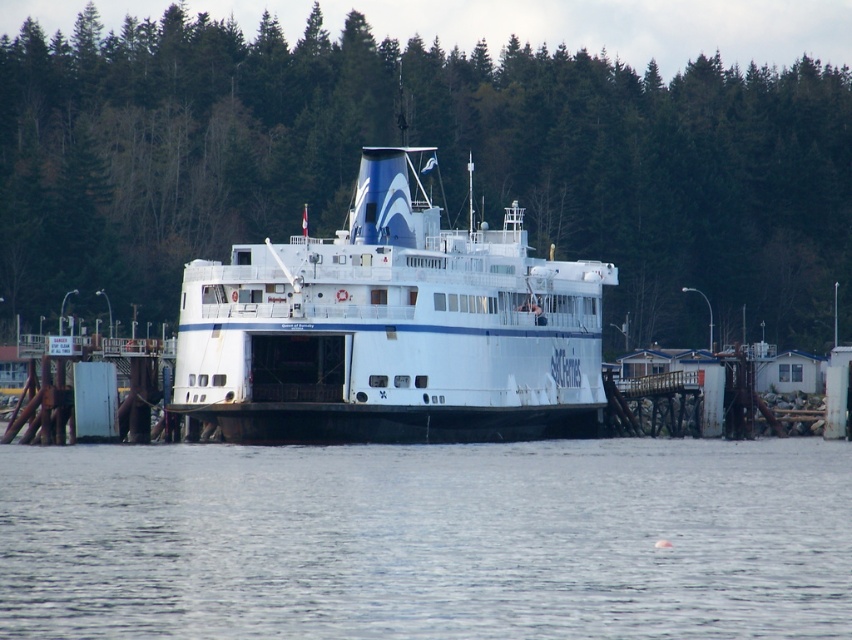
You are a passenger on the ferry and looking towards the shore. You notice the green leafy trees at upper center and the white matte ferry at center. Which object appears taller from your vantage point?

The green leafy trees at upper center appear taller than the white matte ferry at center from your vantage point because the green leafy trees at upper center has a greater height compared to white matte ferry at center.

You are a photographer planning to capture the ferry and its surroundings. You want to ensure that both the green leafy trees at upper center and the clear water at center are visible in your shot. Based on their widths, which object should you prioritize framing first to ensure it fits within the frame?

The green leafy trees at upper center should be prioritized since their width surpasses that of the clear water at center, meaning they take up more space in the image. Ensure the trees are centered or positioned to accommodate their broader width first.

Consider the image. You are standing on the ferry and looking towards the green leafy trees at upper center. If you want to estimate how far you are from the trees, what would you say?

The green leafy trees at upper center are 162.95 meters away from you.